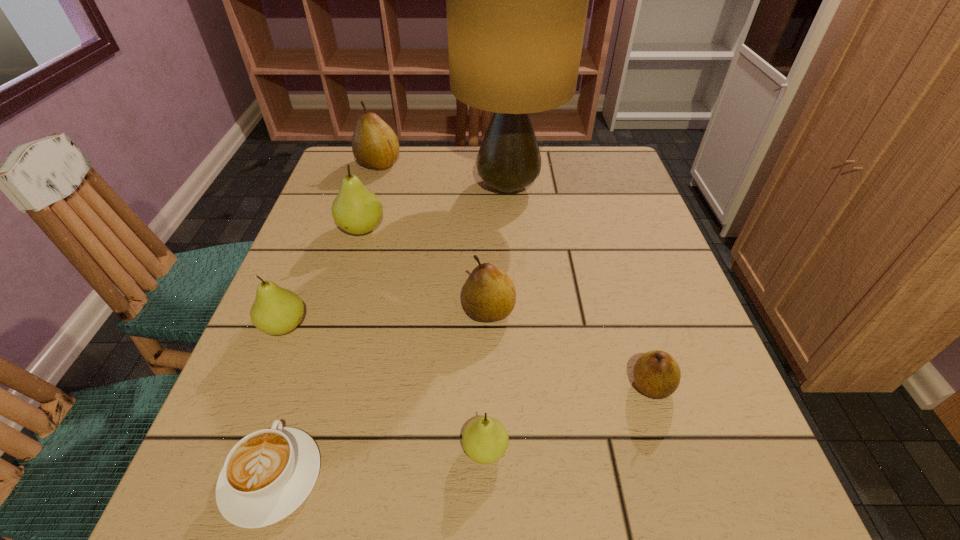
Image resolution: width=960 pixels, height=540 pixels. In order to click on unoccupied area between the tallest object and the second farthest pear in this screenshot , I will do `click(435, 208)`.

This screenshot has width=960, height=540. What are the coordinates of `free area in between the farthest brown pear and the tallest object` in the screenshot? It's located at (444, 175).

Where is `unoccupied position between the tallest object and the cappuccino`? This screenshot has width=960, height=540. unoccupied position between the tallest object and the cappuccino is located at coordinates (390, 332).

Identify the location of vacant area that lies between the second farthest brown pear and the rightmost green pear. [487, 380].

Image resolution: width=960 pixels, height=540 pixels. Identify the location of vacant area between the smallest green pear and the second biggest brown pear. (487, 380).

Choose which object is the nearest neighbor to the second farthest pear. Please provide its 2D coordinates. Your answer should be formatted as a tuple, i.e. [(x, y)], where the tuple contains the x and y coordinates of a point satisfying the conditions above.

[(517, 0)]

You are a GUI agent. You are given a task and a screenshot of the screen. Output one action in this format:
    pyautogui.click(x=<x>, y=<y>)
    Task: Click on the object that is the fifth nearest to the second nearest pear
    Image resolution: width=960 pixels, height=540 pixels.
    Given the screenshot: What is the action you would take?
    pyautogui.click(x=356, y=210)

You are a GUI agent. You are given a task and a screenshot of the screen. Output one action in this format:
    pyautogui.click(x=<x>, y=<y>)
    Task: Click on the fourth closest pear relative to the nearest pear
    The width and height of the screenshot is (960, 540).
    Given the screenshot: What is the action you would take?
    pyautogui.click(x=356, y=210)

Image resolution: width=960 pixels, height=540 pixels. What are the coordinates of `pear identified as the third closest to the lampshade` in the screenshot? It's located at (489, 294).

Where is `brown pear that stands as the closest to the biggest green pear`? The height and width of the screenshot is (540, 960). brown pear that stands as the closest to the biggest green pear is located at coordinates (375, 145).